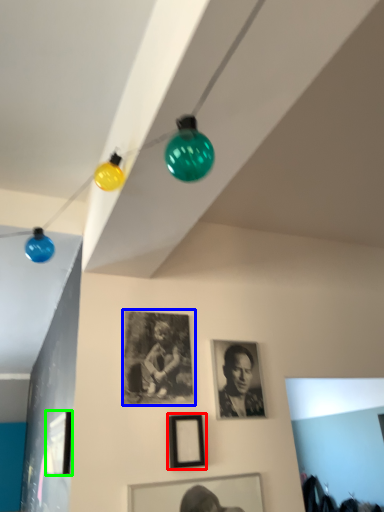
Question: Which object is the farthest from picture frame (highlighted by a red box)? Choose among these: picture frame (highlighted by a blue box) or picture frame (highlighted by a green box).

Choices:
 (A) picture frame
 (B) picture frame

Answer: (B)